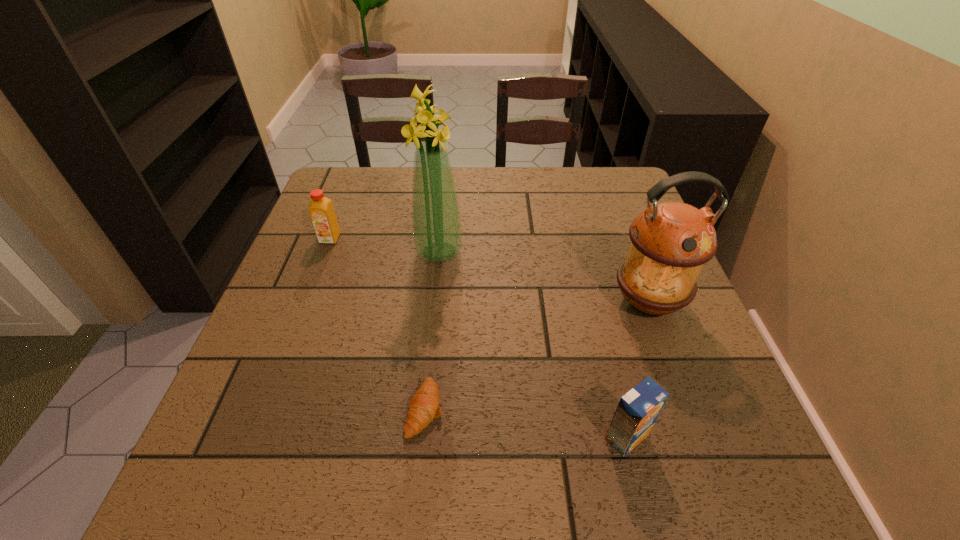
Identify the location of bouquet. (436, 222).

Locate an element on the screen. Image resolution: width=960 pixels, height=540 pixels. the rightmost object is located at coordinates [x=670, y=241].

Where is `the second tallest object`? This screenshot has width=960, height=540. the second tallest object is located at coordinates tap(670, 241).

Identify the location of the left orange_juice. The height and width of the screenshot is (540, 960). (321, 211).

Image resolution: width=960 pixels, height=540 pixels. What are the coordinates of `the leftmost object` in the screenshot? It's located at (321, 211).

You are a GUI agent. You are given a task and a screenshot of the screen. Output one action in this format:
    pyautogui.click(x=<x>, y=<y>)
    Task: Click on the nearer orange_juice
    This screenshot has height=540, width=960.
    Given the screenshot: What is the action you would take?
    pyautogui.click(x=637, y=411)

You are a GUI agent. You are given a task and a screenshot of the screen. Output one action in this format:
    pyautogui.click(x=<x>, y=<y>)
    Task: Click on the right orange_juice
    
    Given the screenshot: What is the action you would take?
    pyautogui.click(x=637, y=411)

At what (x,y) coordinates should I click in order to perform the action: click on crescent roll. Please return your answer as a coordinate pair (x, y). The width and height of the screenshot is (960, 540). Looking at the image, I should click on (424, 406).

At what (x,y) coordinates should I click in order to perform the action: click on free location located on the front-facing side of the bouquet. Please return your answer as a coordinate pair (x, y). Looking at the image, I should click on (609, 252).

The image size is (960, 540). I want to click on vacant space located on the front of the rightmost object, so click(x=714, y=480).